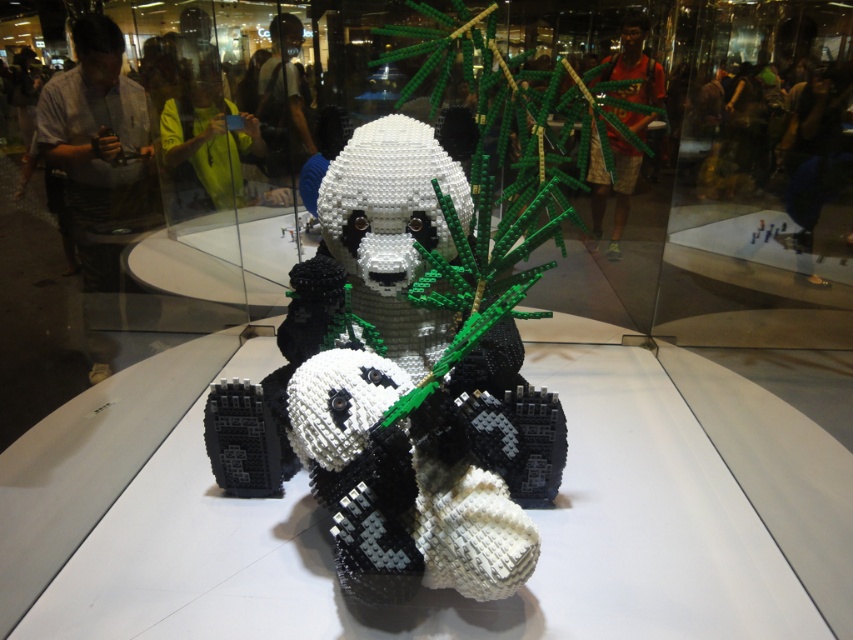
Does white matte lego panda at center appear over black matte lego panda at center?

Correct, white matte lego panda at center is located above black matte lego panda at center.

Is white matte lego panda at center bigger than black matte lego panda at center?

Correct, white matte lego panda at center is larger in size than black matte lego panda at center.

Between point (323, 376) and point (363, 388), which one is positioned in front?

Point (363, 388) is in front.

Locate an element on the screen. The width and height of the screenshot is (853, 640). white matte lego panda at center is located at coordinates (413, 384).